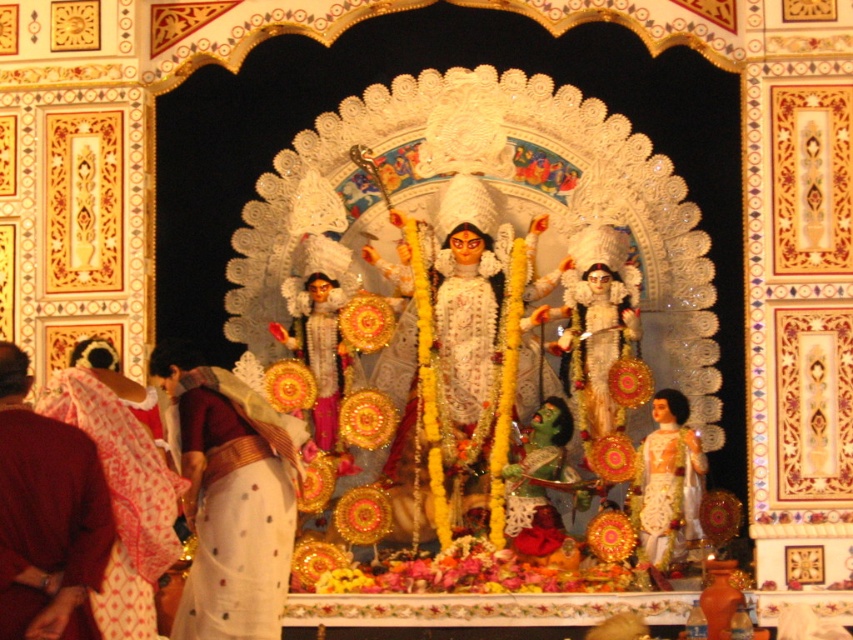
You are a temple volunteer tasked with arranging offerings. You have a white silk saree at center and a white glossy statue at center on the altar. Which object occupies more horizontal space on the altar?

The white silk saree at center has a greater width than the white glossy statue at center, so it occupies more horizontal space on the altar.

You are standing in front of the Hindu temple altar and want to place a small offering. You have two points marked on the altar where you can place it. The first point is at coordinate point(186, 508) and the second is at point(695, 460). Which point is closer to you so that your offering is more accessible?

Point(186, 508) is closer to the viewer than point(695, 460), so placing the offering there would make it more accessible.